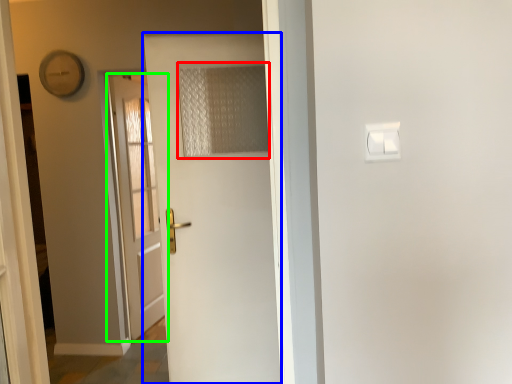
Question: Which object is the closest to the curtain (highlighted by a red box)? Choose among these: door (highlighted by a blue box) or door (highlighted by a green box).

Choices:
 (A) door
 (B) door

Answer: (A)